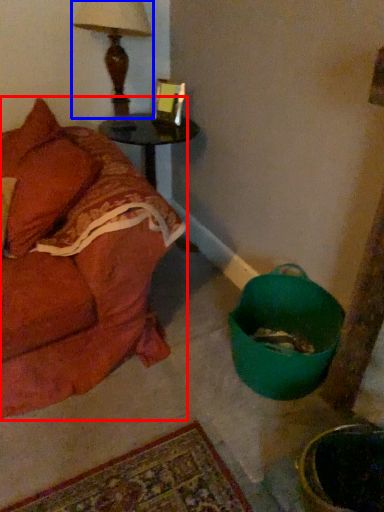
Question: Which object is further to the camera taking this photo, studio couch (highlighted by a red box) or table lamp (highlighted by a blue box)?

Choices:
 (A) studio couch
 (B) table lamp

Answer: (B)